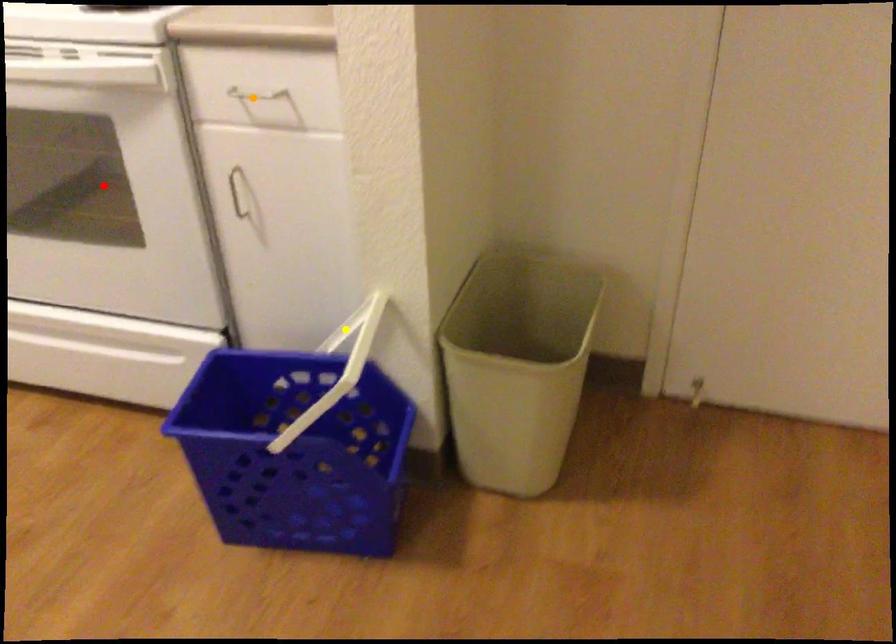
Order these from nearest to farthest:
A) red point
B) yellow point
C) orange point

orange point
yellow point
red point